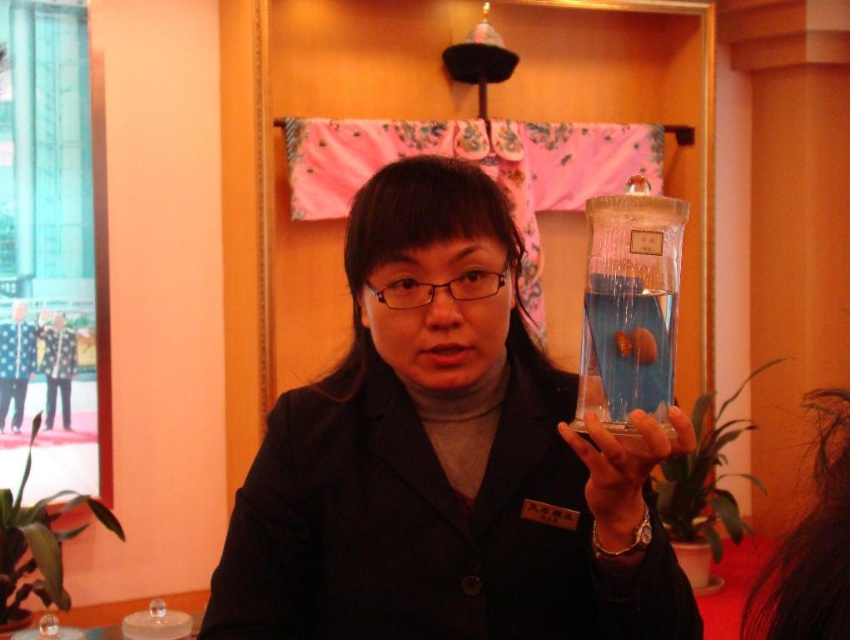
You are a tailor who needs to determine which item, the matte black jacket at center or the transparent glass bottle at center, requires more space for storage. Based on the scene, which one should you allocate more space to?

The matte black jacket at center is larger in size than the transparent glass bottle at center, so you should allocate more storage space to the matte black jacket at center.

You are organizing a science fair exhibit and need to place the matte black jacket at center and the transparent glass bottle at center on a display table. According to the image, which object should be placed to the left to maintain the original arrangement?

The matte black jacket at center should be placed to the left of the transparent glass bottle at center to maintain the original arrangement as shown in the image.

You are an assistant organizing a science fair exhibit. You need to place the matte black jacket at center and the transparent glass bottle at center on a shelf. If the shelf is only wide enough for one of them, which item should you choose to fit based on their widths?

The transparent glass bottle at center has a narrower width compared to the matte black jacket at center. Therefore, the transparent glass bottle at center would fit on the shelf if only one item can be placed.